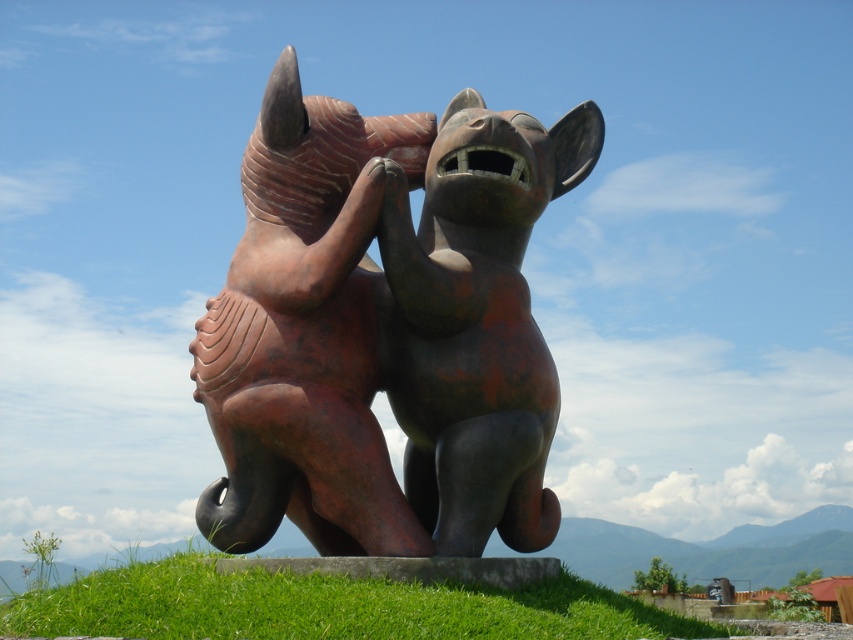
You are an artist standing at the base of the sculpture. You want to place a small statue of a bird between the rusty bronze rhino at center and the green grass at center. Can you fit the bird statue in the space between them if the bird statue is 5 meters long?

The rusty bronze rhino at center and green grass at center are 8.82 meters apart. Since the bird statue is only 5 meters long, it can easily fit in the space between them.

You are standing in front of the sculpture and want to take a photo of the rusty bronze rhino at center. Based on its position, where should you aim your camera to capture it in the frame?

The rusty bronze rhino at center is located at point coordinates approximately 0.516 on the x and 0.454 on the y axis. Therefore, you should aim your camera towards the center of the sculpture to capture it.